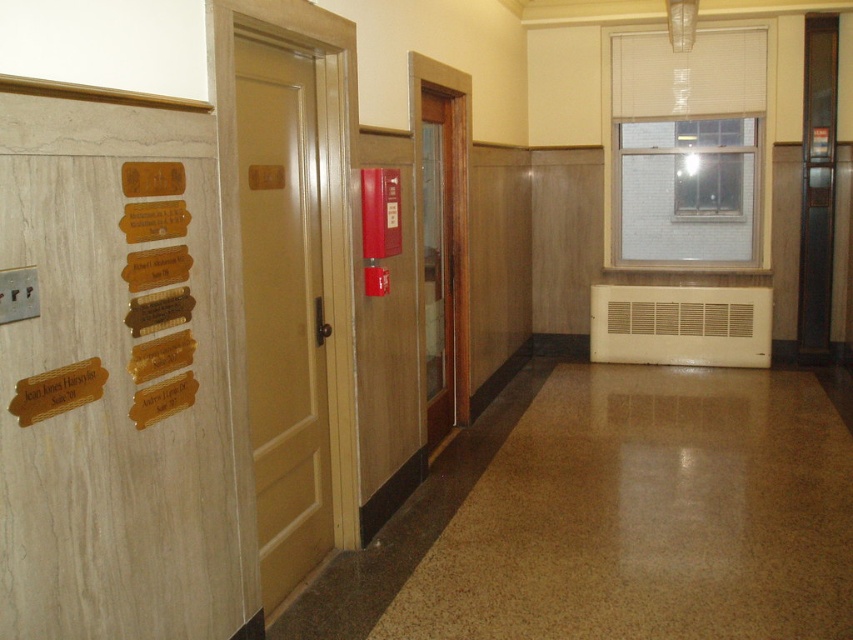
Question: Which of the following is the farthest from the observer?

Choices:
 (A) (442, 397)
 (B) (144, 344)

Answer: (A)

Question: Is gold polished wood nameplates at left closer to the viewer compared to wooden door at center?

Choices:
 (A) no
 (B) yes

Answer: (B)

Question: Is matte wood door at center behind wooden door at center?

Choices:
 (A) yes
 (B) no

Answer: (B)

Question: Which object is closer to the camera taking this photo?

Choices:
 (A) matte wood door at center
 (B) gold polished wood nameplates at left
 (C) wooden door at center

Answer: (B)

Question: Where is matte wood door at center located in relation to gold polished wood nameplates at left in the image?

Choices:
 (A) left
 (B) right

Answer: (B)

Question: Which point is farther to the camera?

Choices:
 (A) wooden door at center
 (B) gold polished wood nameplates at left
 (C) matte wood door at center

Answer: (A)